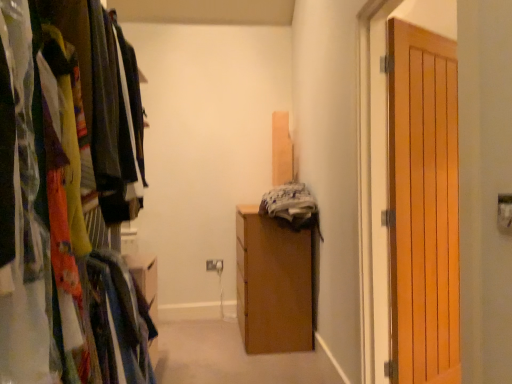
Question: Considering the relative sizes of wooden wardrobe at left and wooden cabinet at center in the image provided, is wooden wardrobe at left smaller than wooden cabinet at center?

Choices:
 (A) yes
 (B) no

Answer: (B)

Question: From the image's perspective, does wooden wardrobe at left appear higher than wooden cabinet at center?

Choices:
 (A) yes
 (B) no

Answer: (A)

Question: Is wooden cabinet at center completely or partially inside wooden wardrobe at left?

Choices:
 (A) yes
 (B) no

Answer: (B)

Question: Could you tell me if wooden wardrobe at left is turned towards wooden cabinet at center?

Choices:
 (A) no
 (B) yes

Answer: (A)

Question: Is the position of wooden wardrobe at left more distant than that of wooden cabinet at center?

Choices:
 (A) yes
 (B) no

Answer: (B)

Question: Is wooden wardrobe at left bigger than wooden cabinet at center?

Choices:
 (A) yes
 (B) no

Answer: (A)

Question: Does wooden door at right lie in front of wooden cabinet at center?

Choices:
 (A) yes
 (B) no

Answer: (A)

Question: Does wooden door at right have a lesser width compared to wooden cabinet at center?

Choices:
 (A) yes
 (B) no

Answer: (A)

Question: From the image's perspective, is wooden door at right located above wooden cabinet at center?

Choices:
 (A) yes
 (B) no

Answer: (A)

Question: Does wooden door at right have a greater width compared to wooden cabinet at center?

Choices:
 (A) no
 (B) yes

Answer: (A)

Question: Is wooden cabinet at center at the back of wooden door at right?

Choices:
 (A) yes
 (B) no

Answer: (A)

Question: Are wooden door at right and wooden cabinet at center located far from each other?

Choices:
 (A) no
 (B) yes

Answer: (B)

Question: Is wooden wardrobe at left to the right of wooden door at right from the viewer's perspective?

Choices:
 (A) no
 (B) yes

Answer: (A)